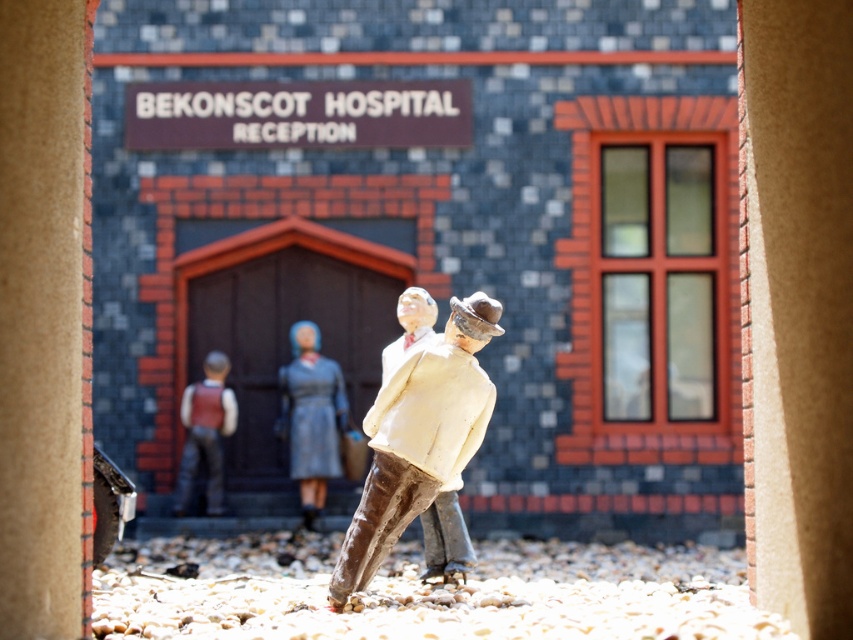
The image size is (853, 640). What do you see at coordinates (422, 449) in the screenshot?
I see `white painted wood figure at center` at bounding box center [422, 449].

Is point (386, 408) positioned in front of point (201, 408)?

Yes, point (386, 408) is in front of point (201, 408).

Image resolution: width=853 pixels, height=640 pixels. Find the location of `white painted wood figure at center`. white painted wood figure at center is located at coordinates (422, 449).

Is matte gray dress at center shorter than brown leather boot at center?

In fact, matte gray dress at center may be taller than brown leather boot at center.

Is point (312, 420) positioned behind point (358, 531)?

Yes, it is.

You are a GUI agent. You are given a task and a screenshot of the screen. Output one action in this format:
    pyautogui.click(x=<x>, y=<y>)
    Task: Click on the matte gray dress at center
    
    Given the screenshot: What is the action you would take?
    pyautogui.click(x=312, y=417)

Does brown leather boot at center lie behind matte brown vest at center?

No.

Which of these two, brown leather boot at center or matte brown vest at center, stands shorter?

brown leather boot at center

The image size is (853, 640). What do you see at coordinates (379, 520) in the screenshot? I see `brown leather boot at center` at bounding box center [379, 520].

You are a GUI agent. You are given a task and a screenshot of the screen. Output one action in this format:
    pyautogui.click(x=<x>, y=<y>)
    Task: Click on the brown leather boot at center
    The image size is (853, 640).
    Given the screenshot: What is the action you would take?
    pyautogui.click(x=379, y=520)